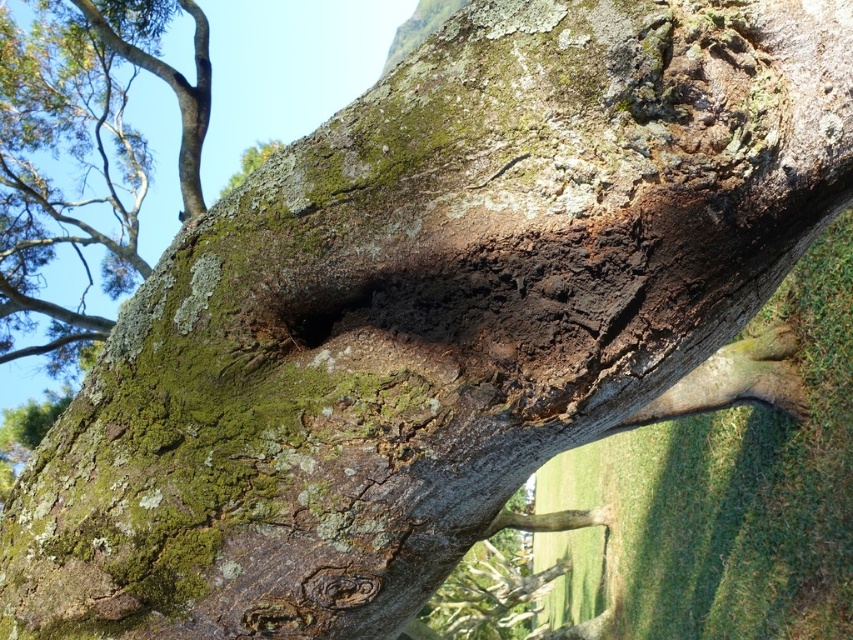
You are a bird looking for a nesting spot. You see the green mossy bark at upper left and the dark brown rough hole at center. Which object is closer to you as you approach the tree?

The green mossy bark at upper left is closer to you because the dark brown rough hole at center is behind it.

You are an artist sketching the tree trunk. You need to decide which area to focus on first based on size. Which object is wider between the green mossy bark at upper left and the dark brown rough hole at center?

The green mossy bark at upper left is wider than the dark brown rough hole at center.

Based on the photo, you are a bird looking for a nesting spot. You see the green mossy bark at upper left and the dark brown rough hole at center. Which location is closer to the left side of the tree trunk?

The green mossy bark at upper left is closer to the left side of the tree trunk because it is positioned to the left of the dark brown rough hole at center.